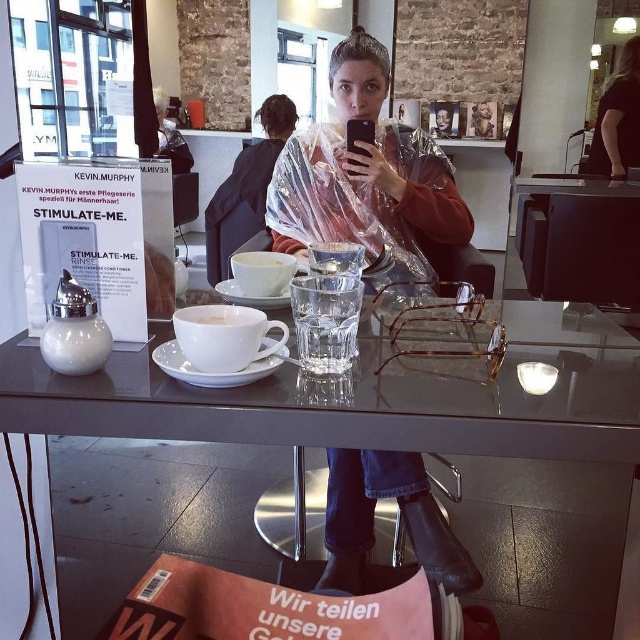
Which of these two, transparent plastic poncho at center or white ceramic cup at center, stands taller?

With more height is transparent plastic poncho at center.

Is transparent plastic poncho at center wider than white ceramic cup at center?

Correct, the width of transparent plastic poncho at center exceeds that of white ceramic cup at center.

I want to click on transparent plastic poncho at center, so click(x=372, y=518).